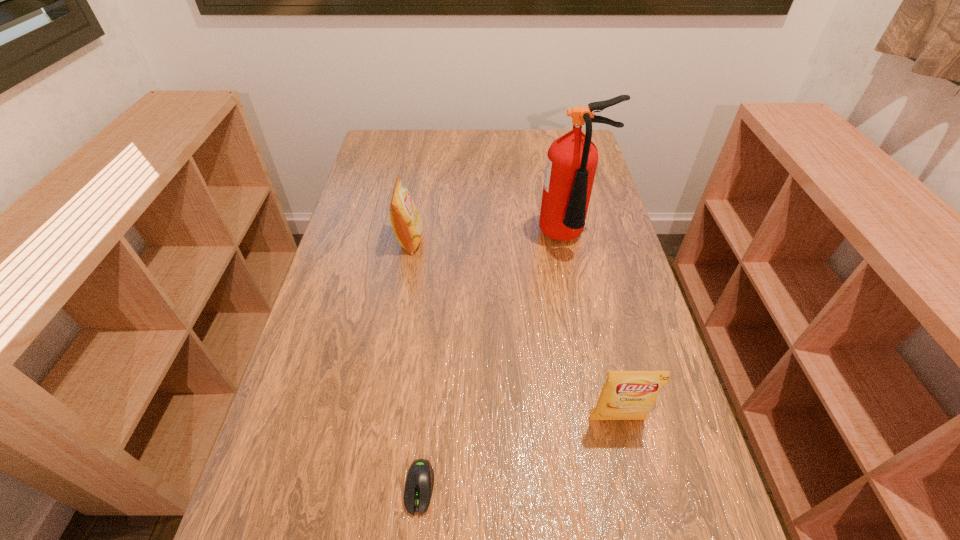
Image resolution: width=960 pixels, height=540 pixels. I want to click on the tallest object, so pos(572,159).

This screenshot has width=960, height=540. I want to click on the nearer crisp (potato chip), so click(626, 395).

At what (x,y) coordinates should I click in order to perform the action: click on the third farthest object. Please return your answer as a coordinate pair (x, y). Looking at the image, I should click on (626, 395).

Where is `the leftmost object`? This screenshot has height=540, width=960. the leftmost object is located at coordinates (407, 224).

You are a GUI agent. You are given a task and a screenshot of the screen. Output one action in this format:
    pyautogui.click(x=<x>, y=<y>)
    Task: Click on the left crisp (potato chip)
    
    Given the screenshot: What is the action you would take?
    pyautogui.click(x=407, y=224)

Locate an element on the screen. This screenshot has height=540, width=960. the third object from right to left is located at coordinates (419, 483).

The height and width of the screenshot is (540, 960). I want to click on the nearest object, so click(x=419, y=483).

This screenshot has width=960, height=540. In order to click on vacant point located 0.120m at the nozzle of the fire extinguisher in this screenshot , I will do `click(581, 293)`.

The height and width of the screenshot is (540, 960). Find the location of `free point located on the front of the third farthest object with the logo`. free point located on the front of the third farthest object with the logo is located at coordinates (630, 474).

Locate an element on the screen. The width and height of the screenshot is (960, 540). free space located on the front-facing side of the leftmost object is located at coordinates (535, 241).